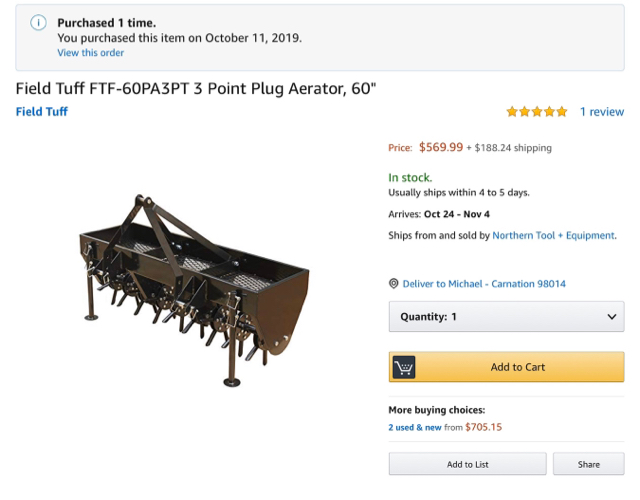
Find the location of a particular element. Image resolution: width=640 pixels, height=500 pixels. leg supports is located at coordinates (230, 354), (90, 290).